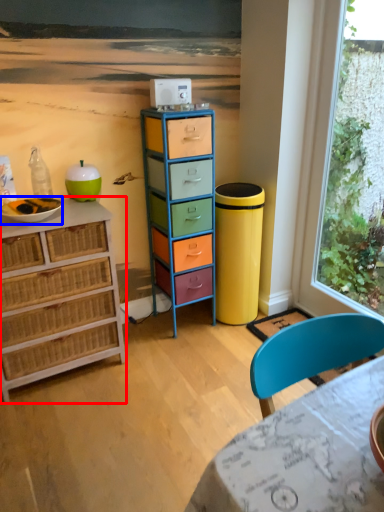
Question: Which object is closer to the camera taking this photo, chest of drawers (highlighted by a red box) or bowl (highlighted by a blue box)?

Choices:
 (A) chest of drawers
 (B) bowl

Answer: (A)